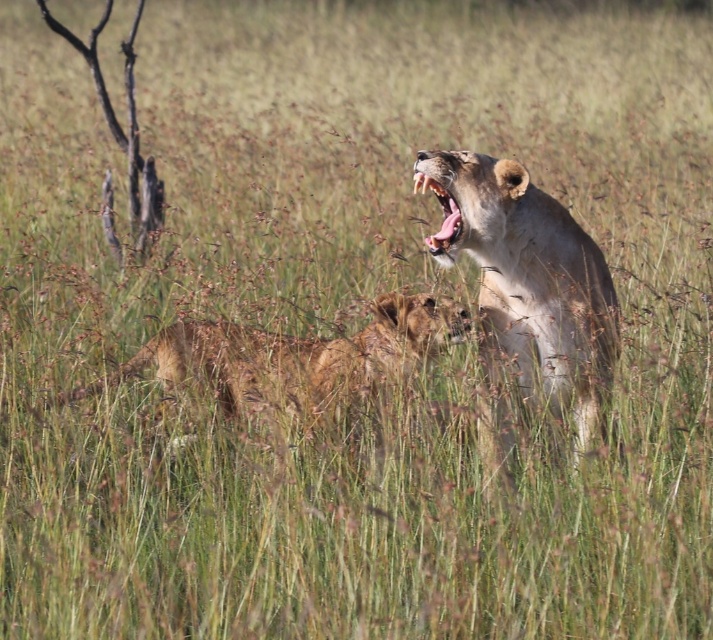
You are a wildlife photographer trying to capture a closeup of the light brown fur lion at upper right and the smooth tan lion mouth at upper right. Based on their positions, which one is wider?

The light brown fur lion at upper right is wider than the smooth tan lion mouth at upper right.

You are a wildlife photographer trying to capture a clear photo of the light brown fur lion at upper right and the smooth tan lion mouth at upper right. However, you notice that one of the objects is blocking the other. Which lion is blocking the other one?

The light brown fur lion at upper right is blocking the smooth tan lion mouth at upper right because it is positioned in front of it.

You are a wildlife photographer trying to capture a clear shot of both the golden fur lion at center and the smooth tan lion mouth at upper right. Given their sizes, which one should you zoom in on more to ensure both are visible in the frame?

The golden fur lion at center is larger than the smooth tan lion mouth at upper right. To ensure both are visible, you should zoom out slightly to accommodate the larger golden fur lion at center while still keeping the smaller smooth tan lion mouth at upper right in view.